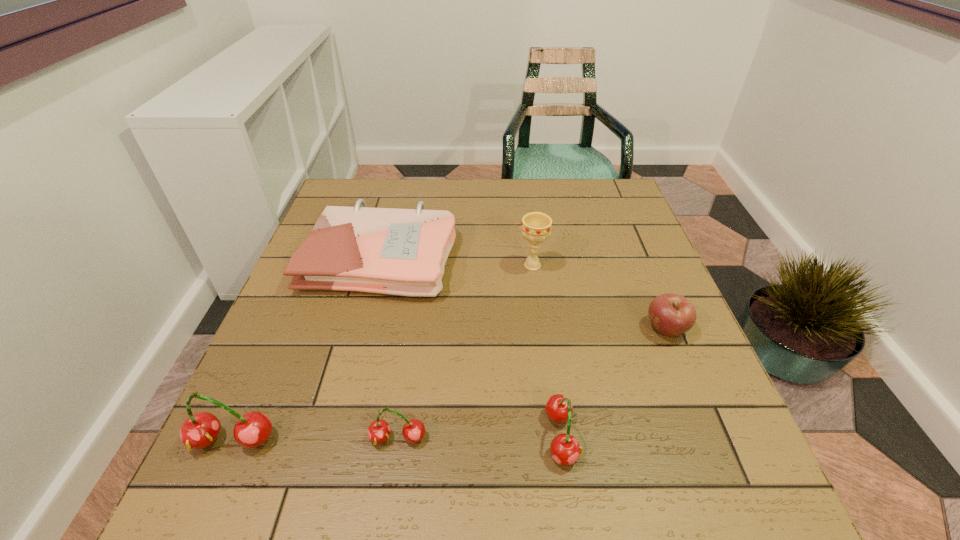
Please point a spot on the right to add another cherry. Please provide its 2D coordinates. Your answer should be formatted as a tuple, i.e. [(x, y)], where the tuple contains the x and y coordinates of a point satisfying the conditions above.

[(724, 434)]